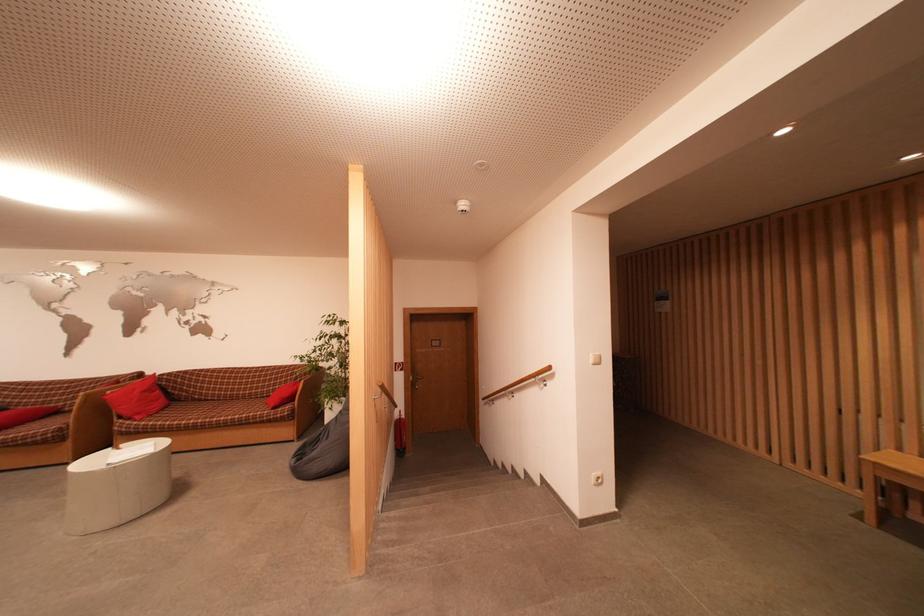
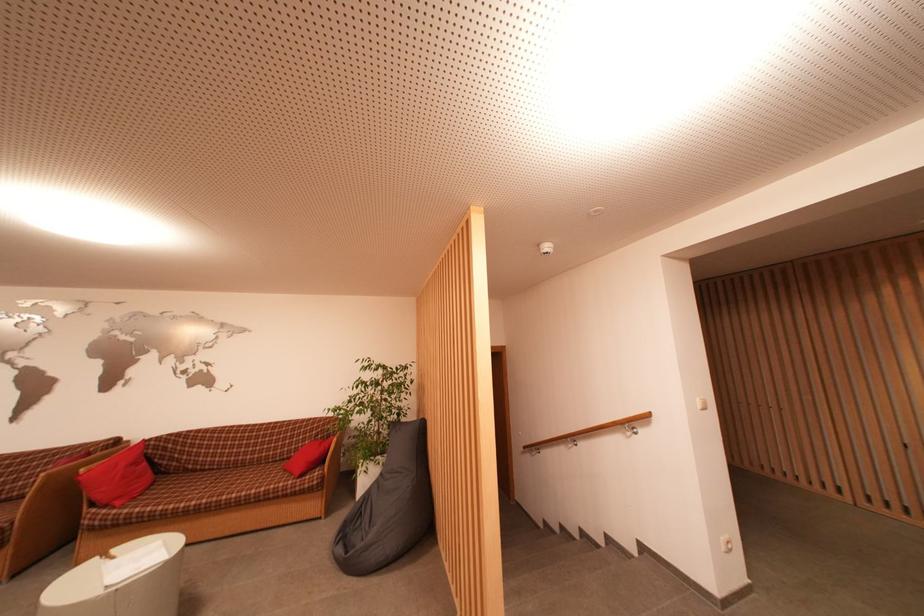
Locate, in the second image, the point that corresponds to (x=203, y=403) in the first image.

(198, 474)